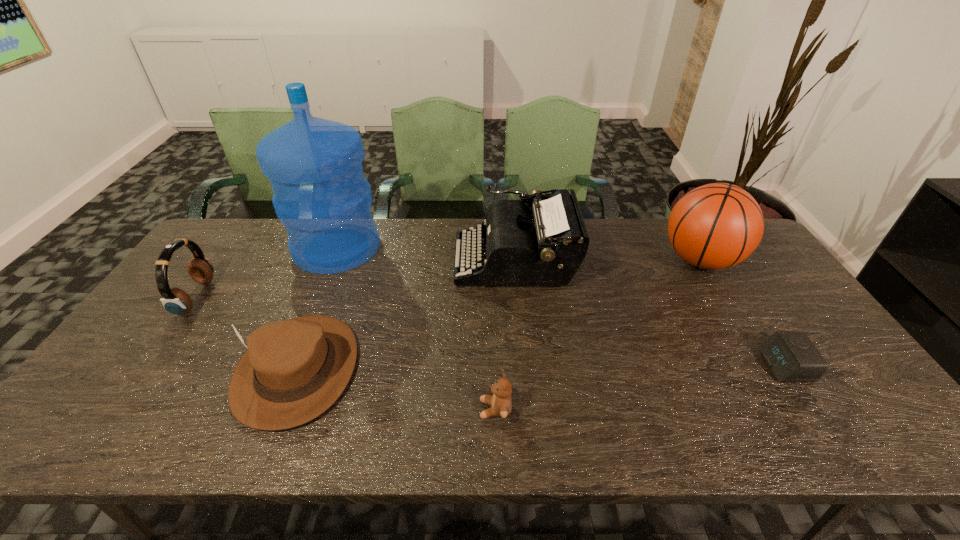
Find the location of a particular element. The image size is (960, 540). vacant area located on the typing side of the typewriter is located at coordinates (360, 260).

At what (x,y) coordinates should I click in order to perform the action: click on free space located 0.250m on the typing side of the typewriter. Please return your answer as a coordinate pair (x, y). This screenshot has height=540, width=960. Looking at the image, I should click on (378, 260).

Find the location of a particular element. The width and height of the screenshot is (960, 540). vacant area situated on the ear cup of the leftmost object is located at coordinates (309, 298).

Where is `blank space located on the front-facing side of the teddy bear`? This screenshot has height=540, width=960. blank space located on the front-facing side of the teddy bear is located at coordinates [380, 409].

You are a GUI agent. You are given a task and a screenshot of the screen. Output one action in this format:
    pyautogui.click(x=<x>, y=<y>)
    Task: Click on the vacant space located on the front-facing side of the teddy bear
    
    Given the screenshot: What is the action you would take?
    pyautogui.click(x=384, y=409)

Where is `free space located 0.100m on the front-facing side of the teddy bear`? This screenshot has width=960, height=540. free space located 0.100m on the front-facing side of the teddy bear is located at coordinates (436, 409).

Locate an element on the screen. vacant region located on the front-facing side of the alarm clock is located at coordinates (656, 366).

This screenshot has height=540, width=960. Find the location of `vacant space located 0.350m on the front-facing side of the alarm clock`. vacant space located 0.350m on the front-facing side of the alarm clock is located at coordinates (628, 366).

You are a GUI agent. You are given a task and a screenshot of the screen. Output one action in this format:
    pyautogui.click(x=<x>, y=<y>)
    Task: Click on the vacant space situated 0.270m on the front-facing side of the alarm clock
    The height and width of the screenshot is (540, 960).
    Given the screenshot: What is the action you would take?
    pyautogui.click(x=660, y=366)

Locate an element on the screen. Image resolution: width=960 pixels, height=540 pixels. water jug at the far edge is located at coordinates (314, 165).